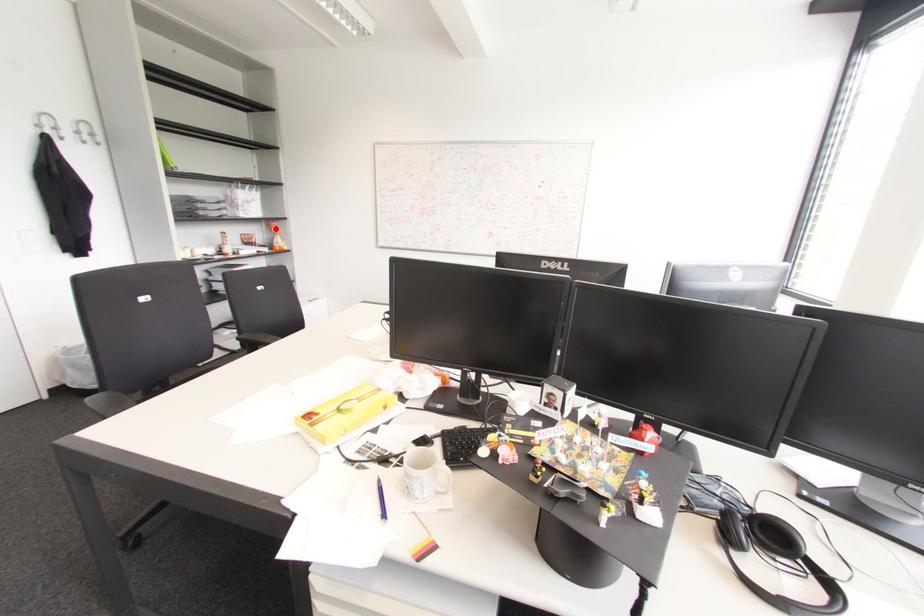
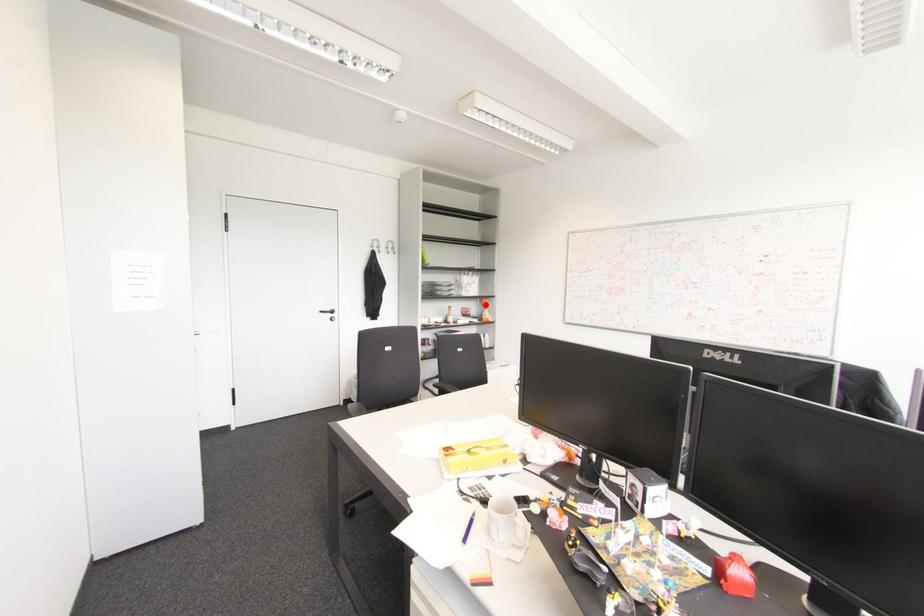
I am providing you with two images of the same scene from different viewpoints. A red point is marked on the first image and another point is marked on the second image. Is the red point in image1 aligned with the point shown in image2?

Yes